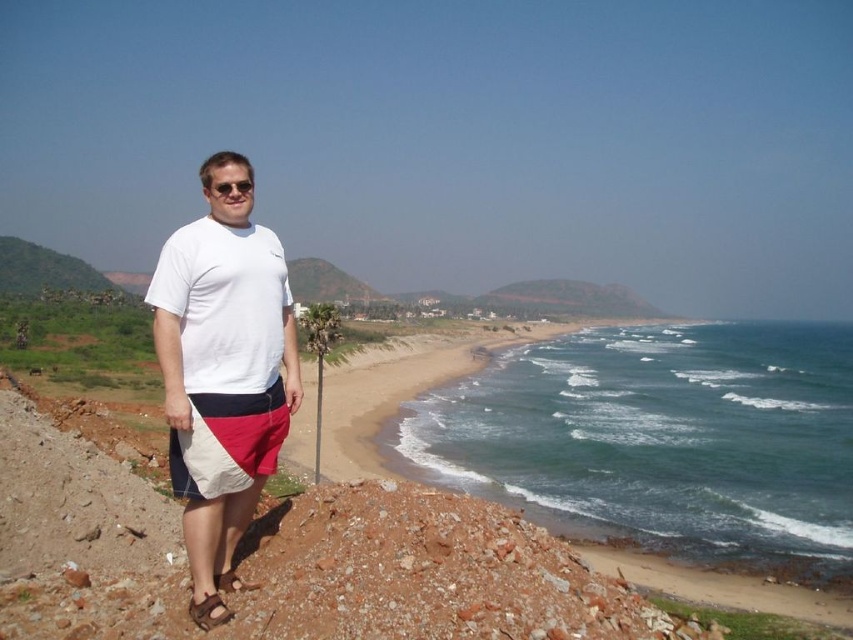
Question: Can you confirm if white cotton t-shirt at center is positioned to the right of white cotton shorts at lower left?

Choices:
 (A) no
 (B) yes

Answer: (A)

Question: Does white cotton t-shirt at center appear over white cotton shorts at lower left?

Choices:
 (A) yes
 (B) no

Answer: (A)

Question: Which point appears farthest from the camera in this image?

Choices:
 (A) (247, 472)
 (B) (268, 316)

Answer: (B)

Question: In this image, where is white cotton t-shirt at center located relative to white cotton shorts at lower left?

Choices:
 (A) right
 (B) left

Answer: (B)

Question: Which point is closer to the camera?

Choices:
 (A) (200, 445)
 (B) (207, 230)

Answer: (A)

Question: Which object appears closest to the camera in this image?

Choices:
 (A) white cotton shorts at lower left
 (B) white cotton t-shirt at center

Answer: (B)